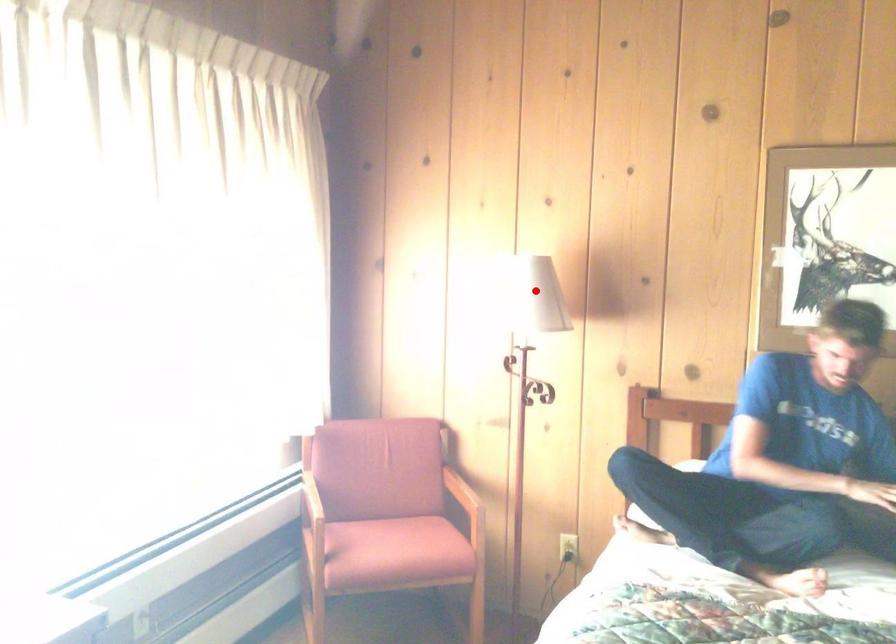
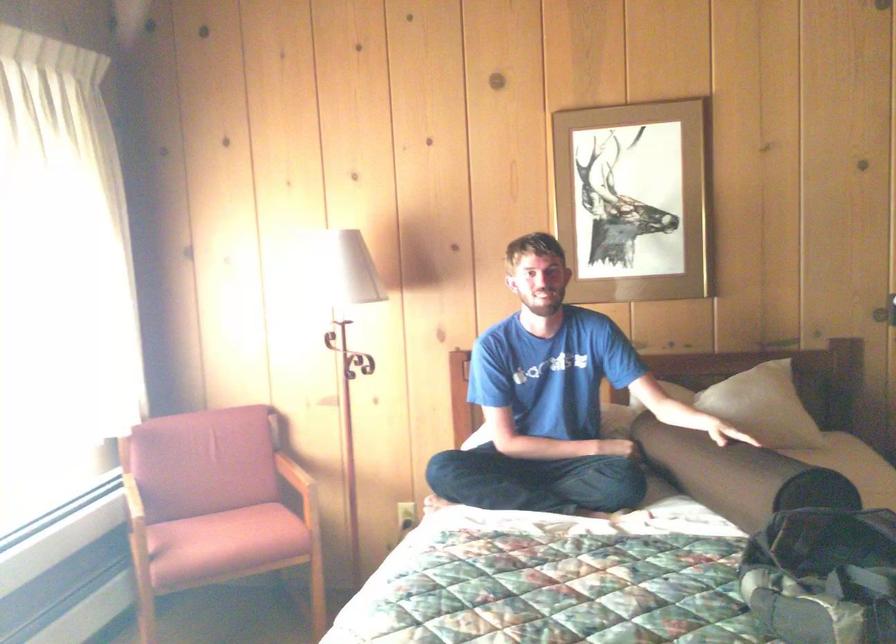
Locate, in the second image, the point that corresponds to the highlighted location in the first image.

(350, 269)